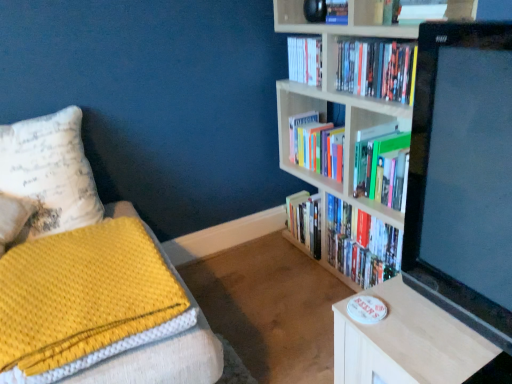
Locate an element on the screen. vacant space situated above hardcover books at upper right, which is the 3th book from back to front (from a real-world perspective) is located at coordinates (376, 43).